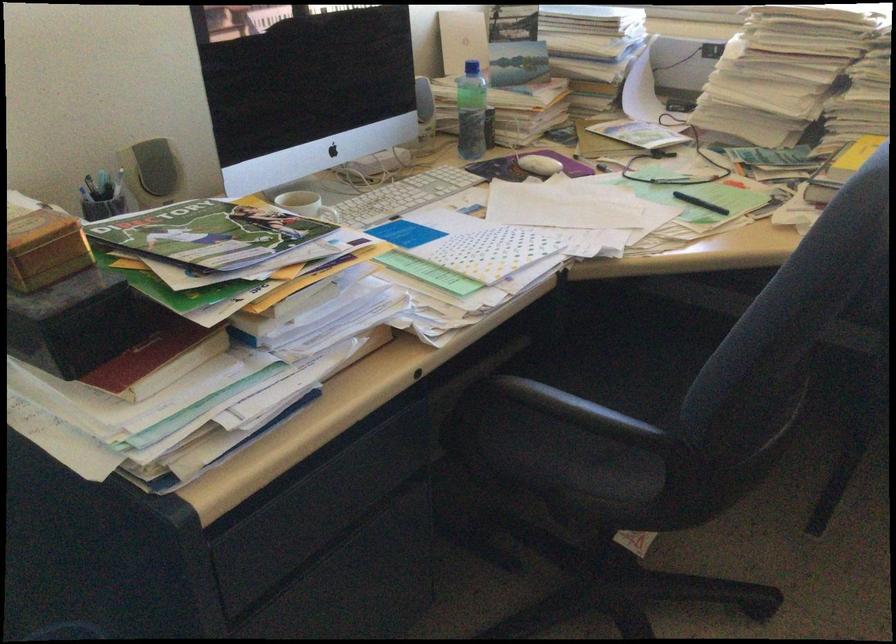
Identify the location of chair armrest. The height and width of the screenshot is (644, 896). (552, 393).